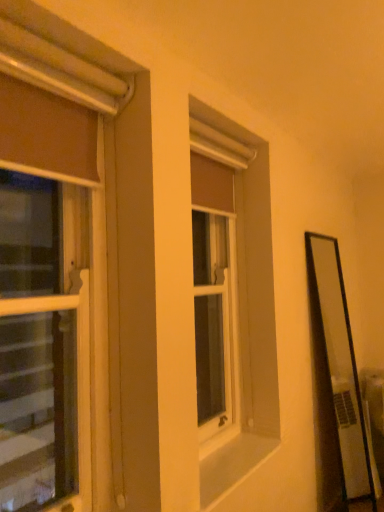
Question: Is matte brown curtain at left, which appears as the 1th window when viewed from the left, oriented away from white smooth window sill at center?

Choices:
 (A) yes
 (B) no

Answer: (B)

Question: Is matte brown curtain at left, which is counted as the 2th window, starting from the back, positioned in front of white smooth window sill at center?

Choices:
 (A) no
 (B) yes

Answer: (B)

Question: Can we say matte brown curtain at left, which is counted as the 2th window, starting from the back, lies outside white smooth window sill at center?

Choices:
 (A) no
 (B) yes

Answer: (B)

Question: Is matte brown curtain at left, which is counted as the 2th window, starting from the back, at the right side of white smooth window sill at center?

Choices:
 (A) yes
 (B) no

Answer: (B)

Question: Is white smooth window sill at center surrounded by matte brown curtain at left, which appears as the 1th window when viewed from the left?

Choices:
 (A) yes
 (B) no

Answer: (B)

Question: Considering the relative sizes of matte brown curtain at left, marked as the first window in a front-to-back arrangement, and white smooth window sill at center in the image provided, is matte brown curtain at left, marked as the first window in a front-to-back arrangement, shorter than white smooth window sill at center?

Choices:
 (A) no
 (B) yes

Answer: (A)

Question: Is matte brown curtain at left, which appears as the 1th window when viewed from the left, far away from matte brown curtain at center, marked as the second window in a front-to-back arrangement?

Choices:
 (A) no
 (B) yes

Answer: (A)

Question: Is matte brown curtain at left, which is counted as the 2th window, starting from the back, to the right of matte brown curtain at center, which is the 1th window in right-to-left order, from the viewer's perspective?

Choices:
 (A) no
 (B) yes

Answer: (A)

Question: Can you confirm if matte brown curtain at left, marked as the first window in a front-to-back arrangement, is taller than matte brown curtain at center, marked as the second window in a front-to-back arrangement?

Choices:
 (A) yes
 (B) no

Answer: (A)

Question: Is matte brown curtain at left, which is counted as the 2th window, starting from the back, further to camera compared to matte brown curtain at center, marked as the second window in a front-to-back arrangement?

Choices:
 (A) yes
 (B) no

Answer: (B)

Question: Does matte brown curtain at left, which ranks as the second window in right-to-left order, turn towards matte brown curtain at center, which is the 1th window in right-to-left order?

Choices:
 (A) no
 (B) yes

Answer: (A)

Question: Is matte brown curtain at left, which is counted as the 2th window, starting from the back, bigger than matte brown curtain at center, which ranks as the second window in left-to-right order?

Choices:
 (A) no
 (B) yes

Answer: (B)

Question: Can you confirm if matte brown curtain at center, marked as the second window in a front-to-back arrangement, is positioned to the right of matte brown curtain at left, marked as the first window in a front-to-back arrangement?

Choices:
 (A) no
 (B) yes

Answer: (B)